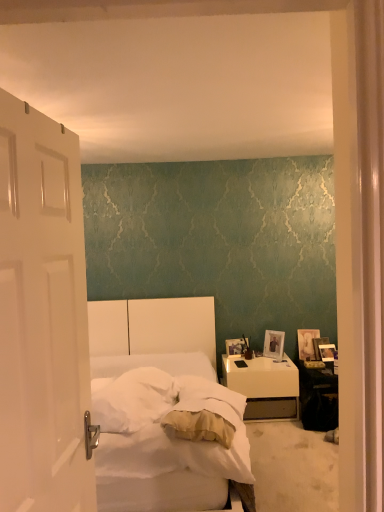
Image resolution: width=384 pixels, height=512 pixels. What do you see at coordinates (236, 346) in the screenshot?
I see `wooden photo frame at right, the 5th picture frame positioned from the right` at bounding box center [236, 346].

What is the approximate width of wooden photo frame at right, which is the 2th picture frame from right to left?

wooden photo frame at right, which is the 2th picture frame from right to left, is 3.07 centimeters wide.

What do you see at coordinates (319, 344) in the screenshot?
I see `wooden photo frame at right, which is the 2th picture frame from right to left` at bounding box center [319, 344].

I want to click on white soft pillow at center, so click(x=132, y=399).

Measure the distance between wooden photo frame at right, acting as the 1th picture frame starting from the right, and camera.

The depth of wooden photo frame at right, acting as the 1th picture frame starting from the right, is 12.55 feet.

I want to click on wooden photo frame at right, which ranks as the 1th picture frame in left-to-right order, so click(236, 346).

From a real-world perspective, is white soft bedsheet at center physically above white matte bed at center?

Correct, in the physical world, white soft bedsheet at center is higher than white matte bed at center.

Does white soft bedsheet at center have a greater width compared to white matte bed at center?

No, white soft bedsheet at center is not wider than white matte bed at center.

Which object is positioned more to the left, white soft bedsheet at center or white matte bed at center?

white matte bed at center is more to the left.

From the image's perspective, is white soft bedsheet at center on top of white matte bed at center?

Yes, from the image's perspective, white soft bedsheet at center is over white matte bed at center.

Considering the positions of points (323, 344) and (332, 346), is point (323, 344) closer to camera compared to point (332, 346)?

No, it is not.

From the image's perspective, is wooden photo frame at right, which is the 2th picture frame from right to left, positioned above or below wooden photo frame at right, acting as the 1th picture frame starting from the right?

wooden photo frame at right, which is the 2th picture frame from right to left, is above wooden photo frame at right, acting as the 1th picture frame starting from the right.

Is the position of wooden photo frame at right, which is the 2th picture frame from right to left, less distant than that of wooden photo frame at right, acting as the 1th picture frame starting from the right?

No.

Between wooden photo frame at right, which is the 2th picture frame from right to left, and wooden photo frame at right, acting as the 1th picture frame starting from the right, which one has larger size?

wooden photo frame at right, acting as the 1th picture frame starting from the right.

Who is shorter, white matte bed at center or white glossy nightstand at lower right?

white glossy nightstand at lower right is shorter.

Is white matte bed at center positioned far away from white glossy nightstand at lower right?

Yes.

Is white matte bed at center bigger or smaller than white glossy nightstand at lower right?

In the image, white matte bed at center appears to be larger than white glossy nightstand at lower right.

Is white matte bed at center turned away from white glossy nightstand at lower right?

No, white matte bed at center is not facing away from white glossy nightstand at lower right.

Looking at this image, are silver metallic photo frame at right, which ranks as the 2th picture frame in left-to-right order, and wooden photo frame at right, acting as the 1th picture frame starting from the right, far apart?

No, silver metallic photo frame at right, which ranks as the 2th picture frame in left-to-right order, is in close proximity to wooden photo frame at right, acting as the 1th picture frame starting from the right.

Could you measure the distance between silver metallic photo frame at right, which is counted as the fourth picture frame, starting from the right, and wooden photo frame at right, acting as the 1th picture frame starting from the right?

silver metallic photo frame at right, which is counted as the fourth picture frame, starting from the right, and wooden photo frame at right, acting as the 1th picture frame starting from the right, are 16.39 inches apart from each other.

Between silver metallic photo frame at right, which ranks as the 2th picture frame in left-to-right order, and wooden photo frame at right, which is the 5th picture frame in left-to-right order, which one has larger width?

silver metallic photo frame at right, which ranks as the 2th picture frame in left-to-right order.

Considering the relative sizes of silver metallic photo frame at right, which is counted as the fourth picture frame, starting from the right, and wooden photo frame at right, acting as the 1th picture frame starting from the right, in the image provided, is silver metallic photo frame at right, which is counted as the fourth picture frame, starting from the right, shorter than wooden photo frame at right, acting as the 1th picture frame starting from the right,?

Incorrect, the height of silver metallic photo frame at right, which is counted as the fourth picture frame, starting from the right, does not fall short of that of wooden photo frame at right, acting as the 1th picture frame starting from the right.

Identify the location of sheet located underneath the white soft pillow at center (from a real-world perspective). (161, 426).

Is point (127, 429) closer to viewer compared to point (201, 453)?

No, it is behind (201, 453).

From a real-world perspective, is white soft pillow at center physically below white soft bedsheet at center?

No.

Is white soft pillow at center to the left or to the right of white soft bedsheet at center in the image?

Clearly, white soft pillow at center is on the left of white soft bedsheet at center in the image.

Which is farther from the camera, (328, 413) or (315, 349)?

Point (315, 349)

Which of these two, black glossy table at lower right or wooden photo frame at right, which is the 2th picture frame from right to left, is thinner?

With smaller width is wooden photo frame at right, which is the 2th picture frame from right to left.

Which is more to the right, black glossy table at lower right or wooden photo frame at right, which is the 2th picture frame from right to left?

wooden photo frame at right, which is the 2th picture frame from right to left.

Can you tell me how much black glossy table at lower right and wooden photo frame at right, the fourth picture frame in the left-to-right sequence, differ in facing direction?

There is a 14.8-degree angle between the facing directions of black glossy table at lower right and wooden photo frame at right, the fourth picture frame in the left-to-right sequence.

Considering the positions of objects wooden photo frame at right, which ranks as the 1th picture frame in left-to-right order, and wooden photo frame at right, the 3th picture frame positioned from the right, in the image provided, who is more to the right, wooden photo frame at right, which ranks as the 1th picture frame in left-to-right order, or wooden photo frame at right, the 3th picture frame positioned from the right,?

Positioned to the right is wooden photo frame at right, the 3th picture frame positioned from the right.

Is wooden photo frame at right, which ranks as the 1th picture frame in left-to-right order, not near wooden photo frame at right, the 3th picture frame positioned from the right?

No.

What's the angular difference between wooden photo frame at right, which ranks as the 1th picture frame in left-to-right order, and wooden photo frame at right, the 3th picture frame positioned from the right,'s facing directions?

8.04 degrees.

From their relative heights in the image, would you say wooden photo frame at right, the 5th picture frame positioned from the right, is taller or shorter than wooden photo frame at right, which is the third picture frame in left-to-right order?

Considering their sizes, wooden photo frame at right, the 5th picture frame positioned from the right, has less height than wooden photo frame at right, which is the third picture frame in left-to-right order.

Where is `sheet above the white matte bed at center (from a real-world perspective)`? sheet above the white matte bed at center (from a real-world perspective) is located at coordinates (161, 426).

In the image, there is a wooden photo frame at right, which is the 2th picture frame from right to left. Where is `picture frame below it (from a real-world perspective)`? This screenshot has height=512, width=384. picture frame below it (from a real-world perspective) is located at coordinates click(x=327, y=352).

Which object lies further to the anchor point white soft bedsheet at center, wooden photo frame at right, which is the third picture frame in left-to-right order, or white glossy nightstand at lower right?

Based on the image, wooden photo frame at right, which is the third picture frame in left-to-right order, appears to be further to white soft bedsheet at center.

Estimate the real-world distances between objects in this image. Which object is closer to white soft pillow at center, white matte door at left or wooden photo frame at right, which is the third picture frame in left-to-right order?

white matte door at left is closer to white soft pillow at center.

Based on their spatial positions, is white matte door at left or black glossy table at lower right further from white soft bedsheet at center?

black glossy table at lower right is positioned further to the anchor white soft bedsheet at center.

When comparing their distances from silver metallic photo frame at right, which ranks as the 2th picture frame in left-to-right order, does wooden photo frame at right, acting as the 1th picture frame starting from the right, or wooden photo frame at right, which is the third picture frame in left-to-right order, seem closer?

wooden photo frame at right, which is the third picture frame in left-to-right order.

Based on their spatial positions, is white soft bedsheet at center or wooden photo frame at right, which ranks as the 1th picture frame in left-to-right order, further from black glossy table at lower right?

Based on the image, white soft bedsheet at center appears to be further to black glossy table at lower right.

From the image, which object appears to be farther from wooden photo frame at right, which is the 5th picture frame in left-to-right order, white soft pillow at center or wooden photo frame at right, which is the third picture frame in left-to-right order?

white soft pillow at center is positioned further to the anchor wooden photo frame at right, which is the 5th picture frame in left-to-right order.

When comparing their distances from silver metallic photo frame at right, which is counted as the fourth picture frame, starting from the right, does black glossy table at lower right or white soft bedsheet at center seem closer?

black glossy table at lower right is closer to silver metallic photo frame at right, which is counted as the fourth picture frame, starting from the right.

Estimate the real-world distances between objects in this image. Which object is closer to black glossy table at lower right, wooden photo frame at right, which ranks as the 1th picture frame in left-to-right order, or wooden photo frame at right, the 3th picture frame positioned from the right?

wooden photo frame at right, the 3th picture frame positioned from the right, is positioned closer to the anchor black glossy table at lower right.

I want to click on table between white soft bedsheet at center and wooden photo frame at right, the 3th picture frame positioned from the right, along the z-axis, so click(318, 398).

This screenshot has width=384, height=512. I want to click on bed between white matte door at left and white soft pillow at center in the front-back direction, so click(x=160, y=408).

Find the location of `pillow positioned between white matte bed at center and wooden photo frame at right, which ranks as the 1th picture frame in left-to-right order, from near to far`. pillow positioned between white matte bed at center and wooden photo frame at right, which ranks as the 1th picture frame in left-to-right order, from near to far is located at coordinates (132, 399).

The width and height of the screenshot is (384, 512). In order to click on sheet positioned between white matte bed at center and wooden photo frame at right, which is the 2th picture frame from right to left, from near to far in this screenshot , I will do pos(161,426).